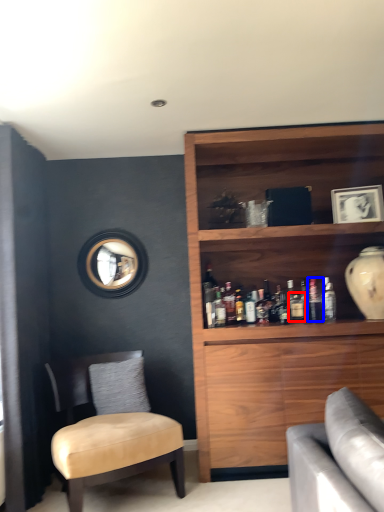
Question: Which object appears farthest to the camera in this image, beverage (highlighted by a red box) or bottle (highlighted by a blue box)?

Choices:
 (A) beverage
 (B) bottle

Answer: (B)